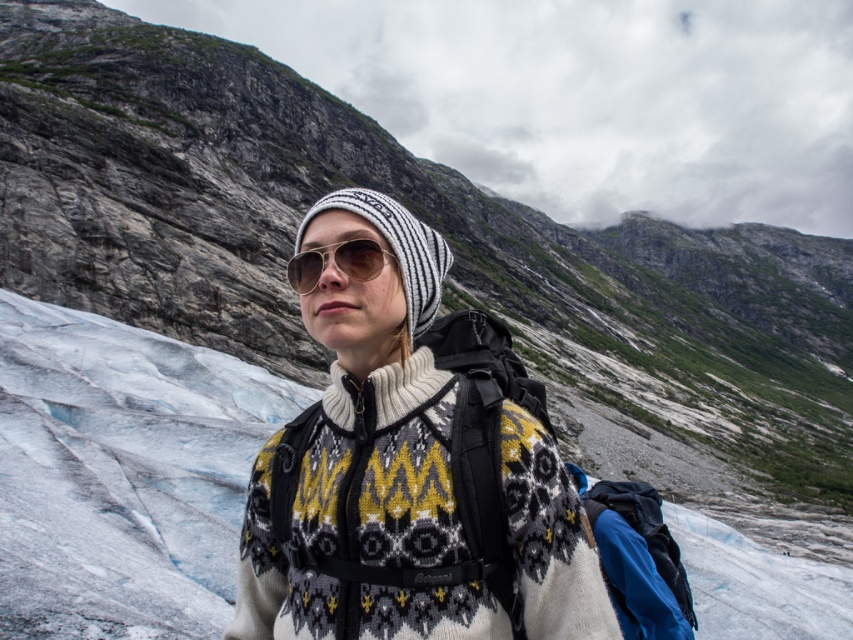
In the scene shown: You are a photographer trying to capture a closeup of the white knit beanie at center and the brown reflective sunglasses at center. Which object will appear wider in your photo?

The white knit beanie at center will appear wider in the photo since its width is larger than that of the brown reflective sunglasses at center.

You are a photographer trying to capture a closeup shot of the white knit beanie at center and the brown reflective sunglasses at center. The camera you have can only focus on objects within a 5 foot range. Can you fit both items in the frame without moving the camera?

The white knit beanie at center and brown reflective sunglasses at center are 6.88 feet apart, which exceeds the camera focus range of 5 feet. Therefore, you cannot fit both items in the frame without moving the camera.

Consider the image. You are a photographer trying to capture the person in the scene. Since both the white knitted sweater at center and the white knit beanie at center are present, which one do you think will be more visible in your photo due to their position?

The white knitted sweater at center is in front of the white knit beanie at center, so the sweater will be more visible in the photo as it is closer to the camera.